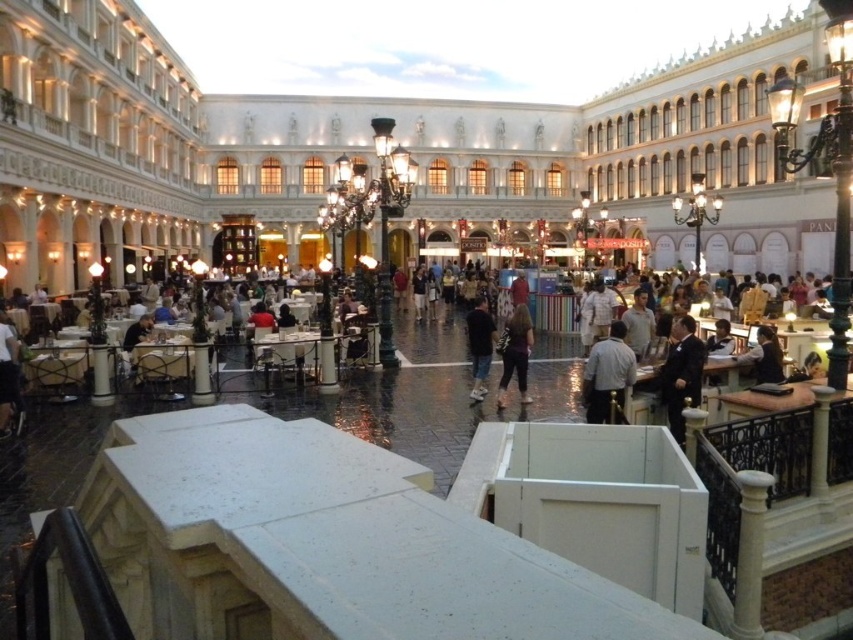
Question: Can you confirm if gray fabric shirt at center is positioned below black cotton shirt at center?

Choices:
 (A) no
 (B) yes

Answer: (B)

Question: Which point is farther to the camera?

Choices:
 (A) (776, 346)
 (B) (611, 380)

Answer: (A)

Question: Does black leather jacket at center have a greater width compared to light brown leather jacket at center?

Choices:
 (A) no
 (B) yes

Answer: (B)

Question: Is black cotton shirt at center to the left of light brown leather jacket at center from the viewer's perspective?

Choices:
 (A) yes
 (B) no

Answer: (A)

Question: Based on their relative distances, which object is nearer to the dark suit at center?

Choices:
 (A) light brown leather jacket at center
 (B) black leather jacket at center
 (C) dark purple fabric at center
 (D) gray fabric shirt at center

Answer: (D)

Question: Which object appears closest to the camera in this image?

Choices:
 (A) light brown leather jacket at center
 (B) black leather jacket at center

Answer: (B)